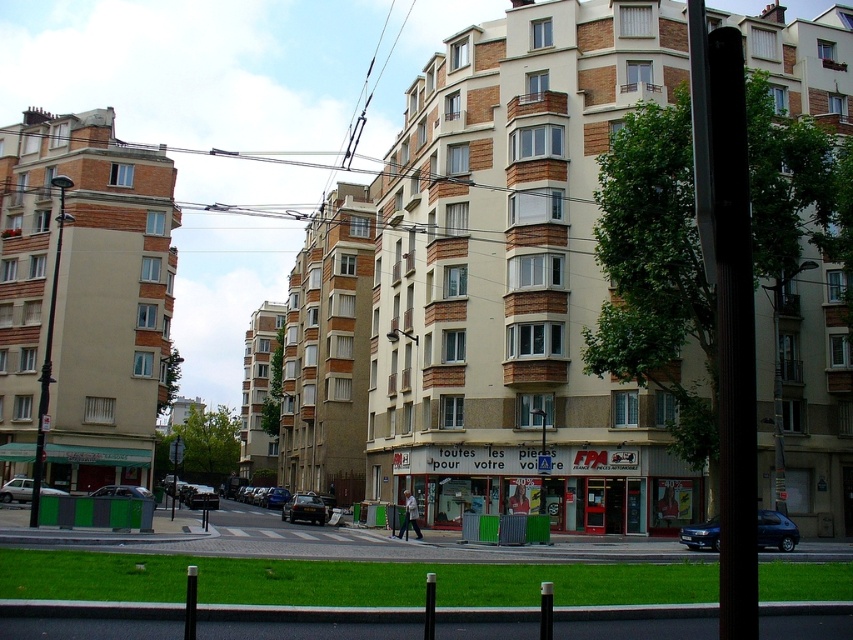
You are standing at the pedestrian crossing and want to walk towards the two points marked in the image. Which point, point (16, 488) or point (114, 486), will you reach first?

Point (16, 488) is closer to you than point (114, 486), so you will reach point (16, 488) first.